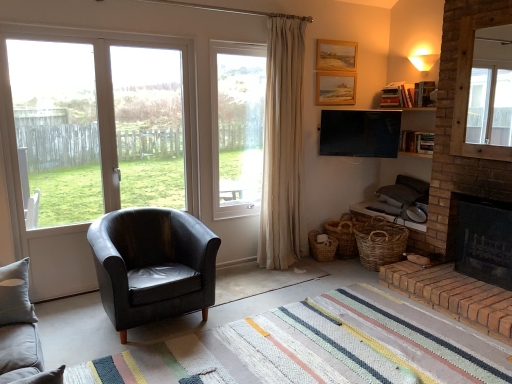
Question: Is rug at center oriented towards transparent glass window at left, which is the 2th window screen in left-to-right order?

Choices:
 (A) yes
 (B) no

Answer: (B)

Question: Does rug at center come in front of transparent glass window at left, which is the 2th window screen in left-to-right order?

Choices:
 (A) no
 (B) yes

Answer: (B)

Question: From a real-world perspective, is rug at center positioned under transparent glass window at left, marked as the first window screen in a right-to-left arrangement, based on gravity?

Choices:
 (A) yes
 (B) no

Answer: (A)

Question: Is rug at center turned away from transparent glass window at left, which is the 2th window screen in left-to-right order?

Choices:
 (A) no
 (B) yes

Answer: (A)

Question: Is there a large distance between rug at center and transparent glass window at left, marked as the first window screen in a right-to-left arrangement?

Choices:
 (A) no
 (B) yes

Answer: (B)

Question: From a real-world perspective, is gray fabric studio couch at lower left positioned above or below transparent glass door at left, which is the 2th window screen in right-to-left order?

Choices:
 (A) above
 (B) below

Answer: (B)

Question: From the image's perspective, relative to transparent glass door at left, which is the 2th window screen in right-to-left order, is gray fabric studio couch at lower left above or below?

Choices:
 (A) below
 (B) above

Answer: (A)

Question: Is point (3, 274) positioned closer to the camera than point (36, 110)?

Choices:
 (A) farther
 (B) closer

Answer: (B)

Question: Visually, is gray fabric studio couch at lower left positioned to the left or to the right of transparent glass door at left, which is counted as the first window screen, starting from the left?

Choices:
 (A) right
 (B) left

Answer: (A)

Question: In terms of size, does wooden picture frame at upper center, the second picture frame from the top, appear bigger or smaller than woven brown basket at lower right, which is the first basket from left to right?

Choices:
 (A) small
 (B) big

Answer: (A)

Question: Is point [x=347, y=76] closer or farther from the camera than point [x=331, y=248]?

Choices:
 (A) closer
 (B) farther

Answer: (B)

Question: Do you think wooden picture frame at upper center, the 1th picture frame in the bottom-to-top sequence, is within woven brown basket at lower right, which is the first basket from left to right, or outside of it?

Choices:
 (A) outside
 (B) inside

Answer: (A)

Question: Relative to woven brown basket at lower right, the second basket when ordered from right to left, is wooden picture frame at upper center, the 1th picture frame in the bottom-to-top sequence, in front or behind?

Choices:
 (A) behind
 (B) front

Answer: (A)

Question: Considering their positions, is clear glass window at center, which is the 1th window in right-to-left order, located in front of or behind transparent glass door at left, which is counted as the first window screen, starting from the left?

Choices:
 (A) behind
 (B) front

Answer: (A)

Question: Is clear glass window at center, marked as the 2th window in a left-to-right arrangement, wider or thinner than transparent glass door at left, which is counted as the first window screen, starting from the left?

Choices:
 (A) wide
 (B) thin

Answer: (A)